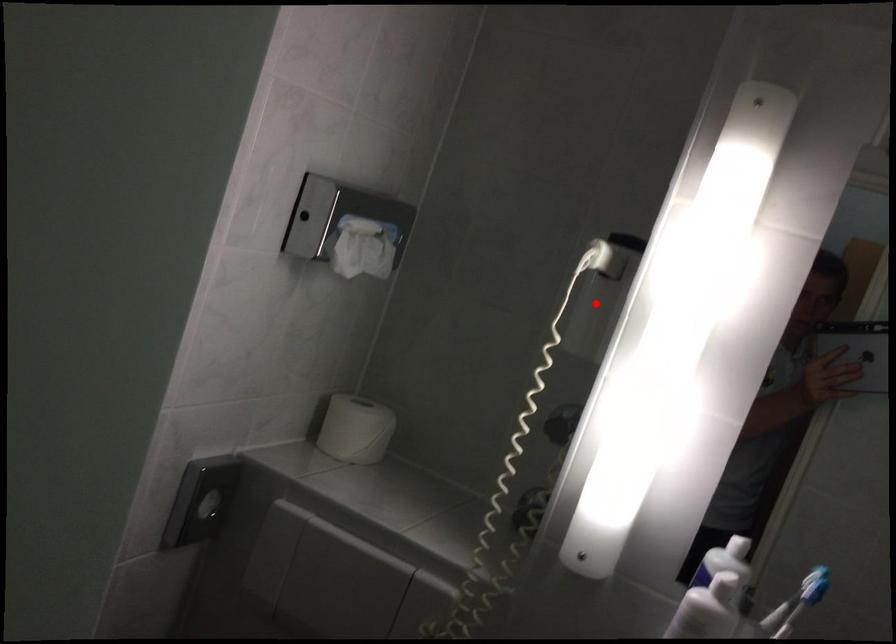
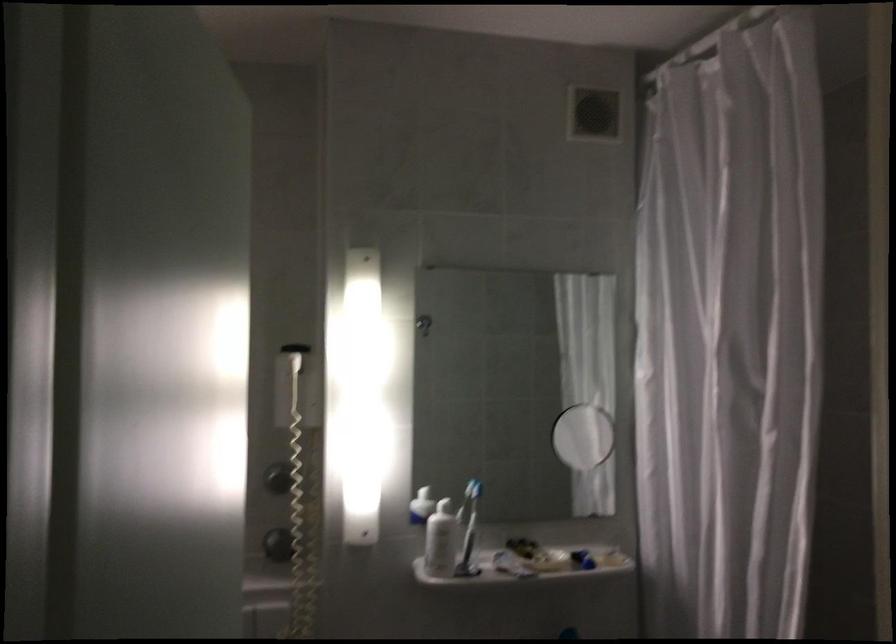
Find the pixel in the second image that matches the highlighted location in the first image.

(293, 384)